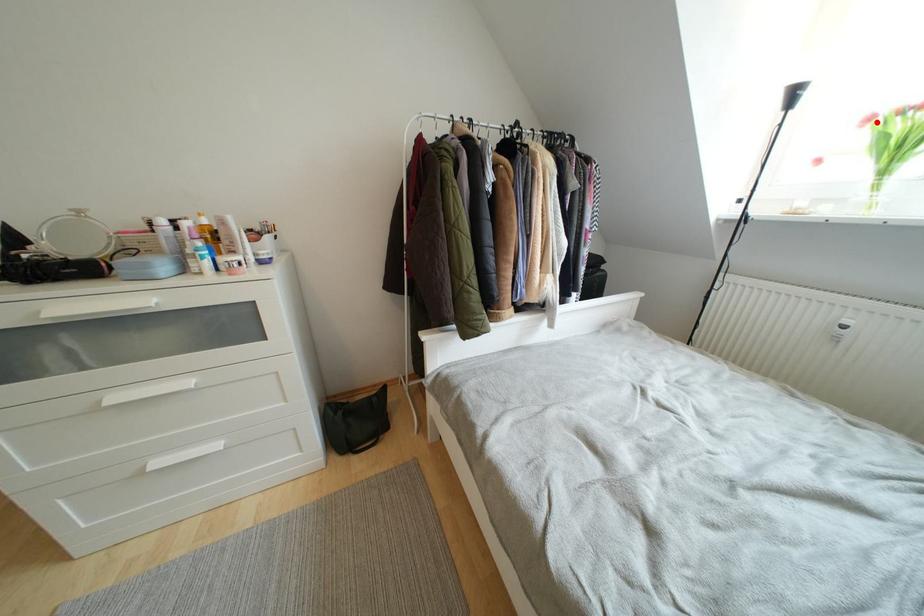
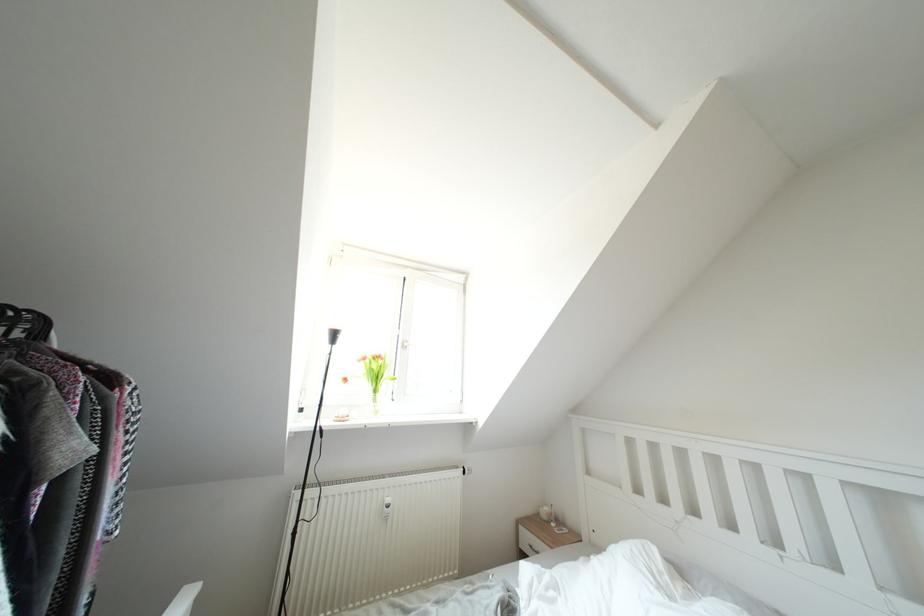
Find the pixel in the second image that matches the highlighted location in the first image.

(370, 363)